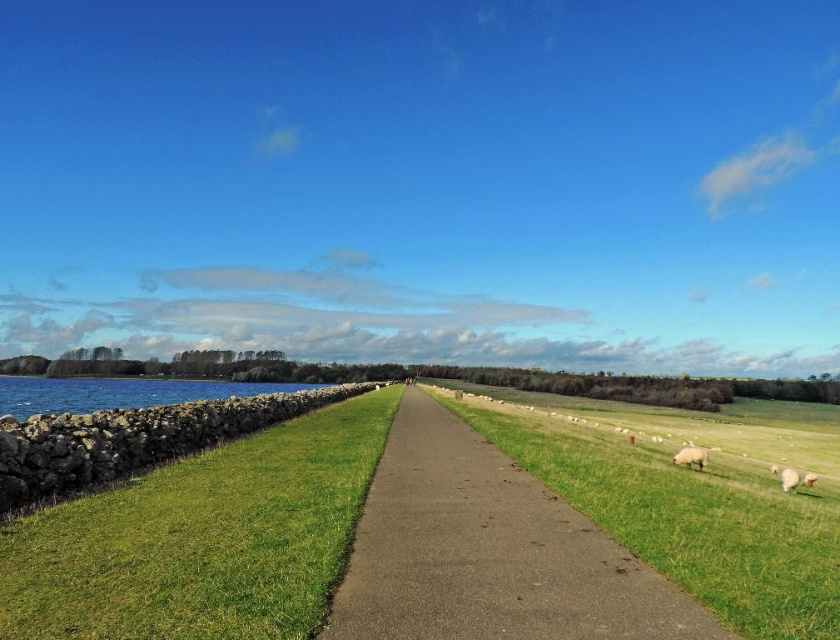
You are standing at the point marked by the coordinates point (489, 552) in the image. What is directly beneath your feet?

The smooth concrete path at center is located at point (489, 552), so the smooth concrete path at center is directly beneath your feet.

You are standing at the center of the pathway in the rural landscape. You want to reach the white woolly sheep at lower right. Which direction should you move in to get closer to them?

The white woolly sheep at lower right is located at point (690, 458), so you should move towards the lower right direction to reach them.